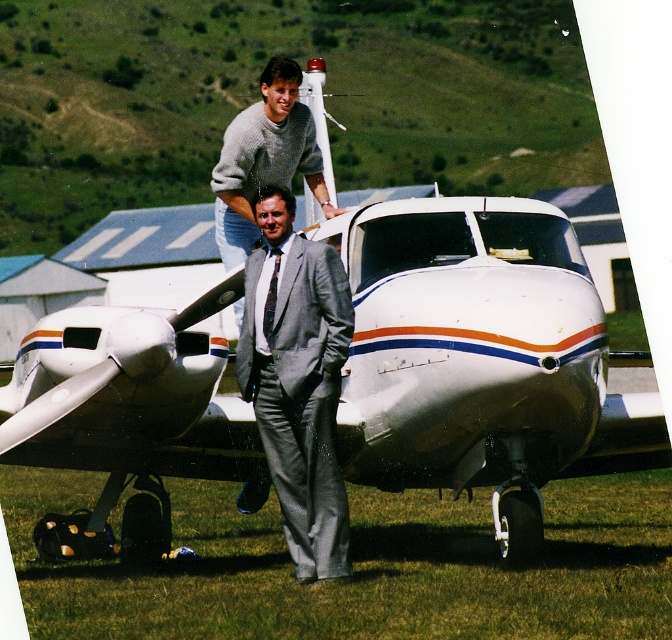
Which is in front, point (312, 339) or point (321, 177)?

Point (312, 339)

Between gray suit at center and knitted sweater at upper center, which one appears on the left side from the viewer's perspective?

knitted sweater at upper center

Where is `gray suit at center`? gray suit at center is located at coordinates (298, 384).

Is knitted sweater at upper center to the right of patterned silk tie at center from the viewer's perspective?

In fact, knitted sweater at upper center is to the left of patterned silk tie at center.

This screenshot has width=672, height=640. What do you see at coordinates (263, 157) in the screenshot?
I see `knitted sweater at upper center` at bounding box center [263, 157].

Where is `knitted sweater at upper center`? This screenshot has height=640, width=672. knitted sweater at upper center is located at coordinates pos(263,157).

Locate an element on the screen. The width and height of the screenshot is (672, 640). knitted sweater at upper center is located at coordinates (263, 157).

Who is higher up, gray suit at center or patterned silk tie at center?

Positioned higher is patterned silk tie at center.

Is gray suit at center bigger than patterned silk tie at center?

Indeed, gray suit at center has a larger size compared to patterned silk tie at center.

Which is behind, point (310, 432) or point (267, 307)?

Point (267, 307)

Identify the location of gray suit at center. (298, 384).